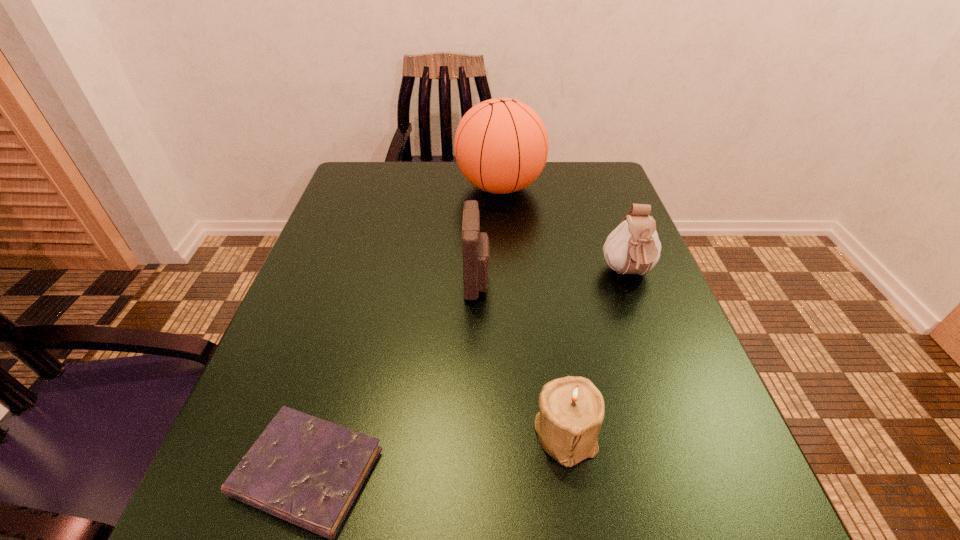
Find the location of a particular element. This screenshot has height=540, width=960. object situated at the right edge is located at coordinates (633, 247).

Identify the location of free space at the far edge of the desktop. The width and height of the screenshot is (960, 540). (443, 204).

Locate an element on the screen. vacant space at the left edge is located at coordinates (306, 397).

At what (x,y) coordinates should I click in order to perform the action: click on vacant region at the right edge of the desktop. Please return your answer as a coordinate pair (x, y). The width and height of the screenshot is (960, 540). Looking at the image, I should click on (588, 310).

The image size is (960, 540). In order to click on free space at the far left corner of the desktop in this screenshot , I will do `click(398, 164)`.

Image resolution: width=960 pixels, height=540 pixels. Find the location of `vacant space at the far right corner of the desktop`. vacant space at the far right corner of the desktop is located at coordinates (585, 206).

Where is `vacant area that lies between the right pouch and the farthest object`? Image resolution: width=960 pixels, height=540 pixels. vacant area that lies between the right pouch and the farthest object is located at coordinates (564, 231).

The height and width of the screenshot is (540, 960). I want to click on free space between the left pouch and the candle_holder, so click(521, 356).

Image resolution: width=960 pixels, height=540 pixels. I want to click on vacant area that lies between the rightmost object and the basketball, so click(564, 231).

The image size is (960, 540). I want to click on vacant area between the right pouch and the candle_holder, so click(596, 353).